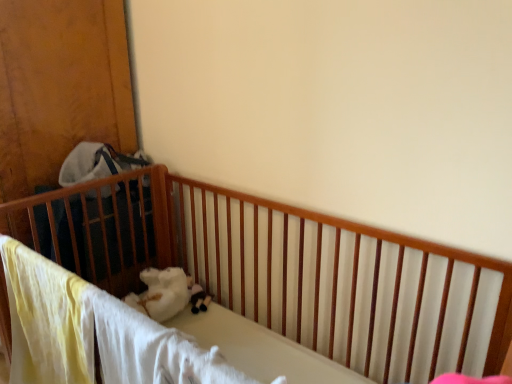
Question: Is wooden crib at left closer to the viewer compared to soft plush toy at center?

Choices:
 (A) no
 (B) yes

Answer: (B)

Question: Is wooden crib at left positioned behind soft plush toy at center?

Choices:
 (A) yes
 (B) no

Answer: (B)

Question: Is wooden crib at left completely or partially outside of soft plush toy at center?

Choices:
 (A) yes
 (B) no

Answer: (A)

Question: Considering the relative positions of wooden crib at left and soft plush toy at center in the image provided, is wooden crib at left to the left of soft plush toy at center from the viewer's perspective?

Choices:
 (A) no
 (B) yes

Answer: (B)

Question: From a real-world perspective, is wooden crib at left on top of soft plush toy at center?

Choices:
 (A) no
 (B) yes

Answer: (B)

Question: From the image's perspective, would you say wooden crib at left is positioned over soft plush toy at center?

Choices:
 (A) yes
 (B) no

Answer: (A)

Question: From the image's perspective, is soft plush toy at center above wooden crib at left?

Choices:
 (A) no
 (B) yes

Answer: (A)

Question: Is soft plush toy at center bigger than wooden crib at left?

Choices:
 (A) yes
 (B) no

Answer: (B)

Question: Are soft plush toy at center and wooden crib at left located far from each other?

Choices:
 (A) no
 (B) yes

Answer: (A)

Question: Is soft plush toy at center at the left side of wooden crib at left?

Choices:
 (A) yes
 (B) no

Answer: (B)

Question: Is wooden crib at left inside soft plush toy at center?

Choices:
 (A) yes
 (B) no

Answer: (B)

Question: Is soft plush toy at center thinner than wooden crib at left?

Choices:
 (A) no
 (B) yes

Answer: (B)

Question: In terms of size, does wooden crib at left appear bigger or smaller than soft plush toy at center?

Choices:
 (A) big
 (B) small

Answer: (A)